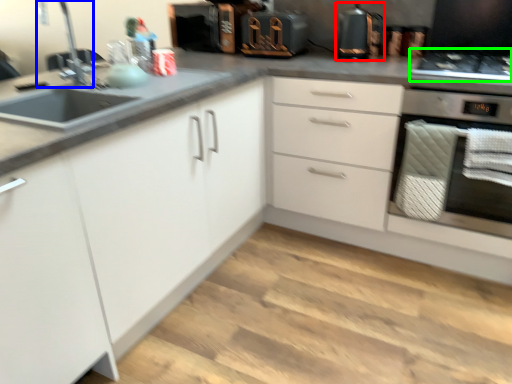
Question: Which is nearer to the kitchen appliance (highlighted by a red box)? faucet (highlighted by a blue box) or gas stove (highlighted by a green box).

Choices:
 (A) faucet
 (B) gas stove

Answer: (B)